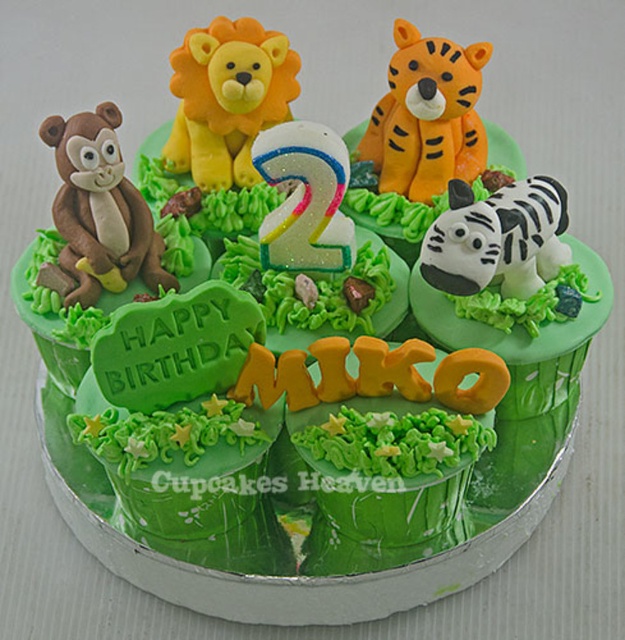
You are a birthday party planner arranging decorations. You have a small plate that can hold items up to 10 cm wide. You need to place either the yellow fondant lion at upper center or the white matte tiger at upper right on the plate. Which animal figure can fit on the plate?

The yellow fondant lion at upper center has a lesser width compared to the white matte tiger at upper right. Therefore, the yellow fondant lion at upper center can fit on the plate since it is narrower than the 10 cm limit.

You are a birthday party planner and need to place a small candle on the cake. The cake has an orange matte tiger at upper right and a white matte tiger at upper right. Which tiger should you place the candle on to ensure it is more visible?

The orange matte tiger at upper right is larger than the white matte tiger at upper right, so placing the candle on the orange matte tiger at upper right will make it more visible due to its larger size.